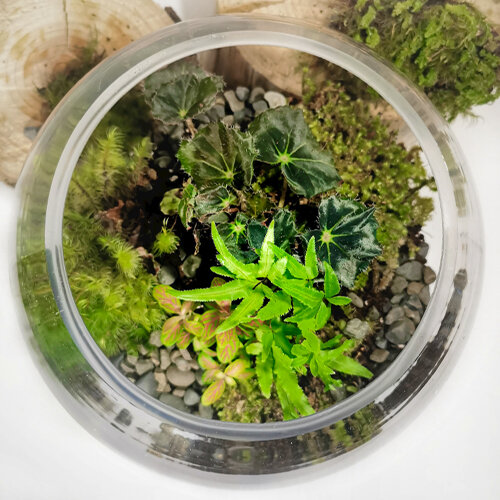
Where is `clear bowl`? The image size is (500, 500). clear bowl is located at coordinates (38, 233).